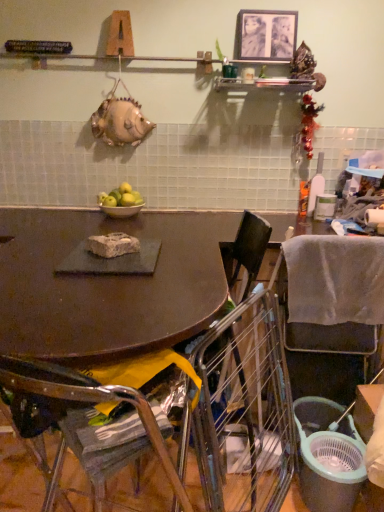
Question: Is metallic silver bowl at center not near metallic silver picture frame at upper center?

Choices:
 (A) no
 (B) yes

Answer: (A)

Question: Does metallic silver bowl at center have a smaller size compared to metallic silver picture frame at upper center?

Choices:
 (A) no
 (B) yes

Answer: (A)

Question: Considering the relative sizes of metallic silver bowl at center and metallic silver picture frame at upper center in the image provided, is metallic silver bowl at center thinner than metallic silver picture frame at upper center?

Choices:
 (A) yes
 (B) no

Answer: (B)

Question: Is metallic silver bowl at center located outside metallic silver picture frame at upper center?

Choices:
 (A) yes
 (B) no

Answer: (A)

Question: Is metallic silver bowl at center with metallic silver picture frame at upper center?

Choices:
 (A) yes
 (B) no

Answer: (B)

Question: Does metallic silver bowl at center have a lesser height compared to metallic silver picture frame at upper center?

Choices:
 (A) no
 (B) yes

Answer: (B)

Question: Does metallic silver picture frame at upper center contain metallic silver bowl at center?

Choices:
 (A) yes
 (B) no

Answer: (B)

Question: Is the position of metallic silver picture frame at upper center more distant than that of metallic silver bowl at center?

Choices:
 (A) no
 (B) yes

Answer: (A)

Question: Does metallic silver picture frame at upper center turn towards metallic silver bowl at center?

Choices:
 (A) yes
 (B) no

Answer: (B)

Question: Is metallic silver picture frame at upper center thinner than metallic silver bowl at center?

Choices:
 (A) no
 (B) yes

Answer: (B)

Question: Is metallic silver picture frame at upper center positioned beyond the bounds of metallic silver bowl at center?

Choices:
 (A) no
 (B) yes

Answer: (B)

Question: From a real-world perspective, is metallic silver picture frame at upper center physically above metallic silver bowl at center?

Choices:
 (A) no
 (B) yes

Answer: (B)

Question: From a real-world perspective, is green matte apples at center physically below matte black table at center?

Choices:
 (A) no
 (B) yes

Answer: (A)